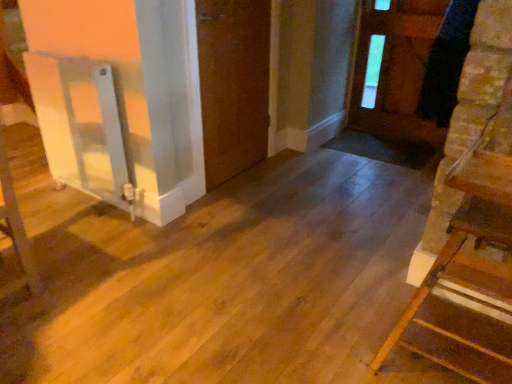
The width and height of the screenshot is (512, 384). In order to click on free space that is in between wooden staircase at right and brown matte door at center, which is the 1th door from left to right in this screenshot , I will do `click(312, 232)`.